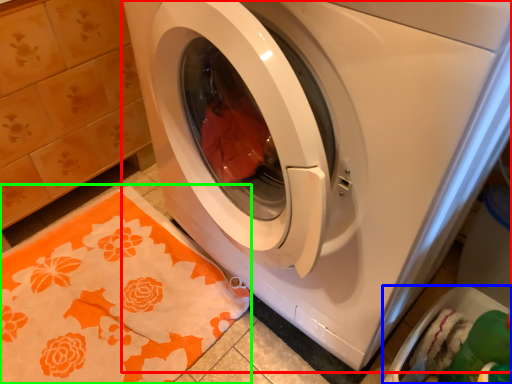
Question: Based on their relative distances, which object is farther from washing machine (highlighted by a red box)? Choose from dish washer (highlighted by a blue box) and blanket (highlighted by a green box).

Choices:
 (A) dish washer
 (B) blanket

Answer: (A)